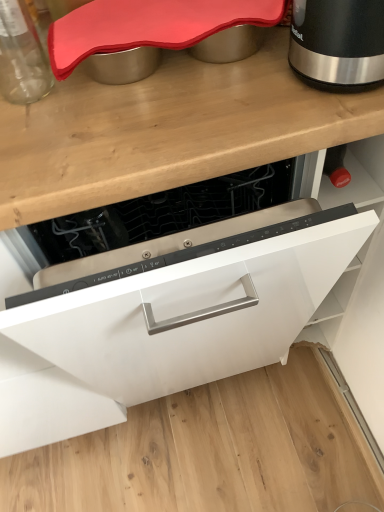
What do you see at coordinates (21, 56) in the screenshot?
I see `transparent glass jar at upper left` at bounding box center [21, 56].

What do you see at coordinates (338, 42) in the screenshot?
I see `black metallic kettle at upper right` at bounding box center [338, 42].

Find the location of `white matte cabinet at center`. white matte cabinet at center is located at coordinates (166, 323).

From a real-world perspective, between white matte cabinet at center and black metallic kettle at upper right, who is vertically lower?

From a 3D spatial view, white matte cabinet at center is below.

Does point (358, 381) come in front of point (294, 49)?

No, it is not.

Would you consider white matte cabinet at center to be distant from black metallic kettle at upper right?

Actually, white matte cabinet at center and black metallic kettle at upper right are a little close together.

Does black metallic kettle at upper right turn towards transparent glass jar at upper left?

Yes, black metallic kettle at upper right is facing transparent glass jar at upper left.

Where is `home appliance lying in front of the transparent glass jar at upper left`? The height and width of the screenshot is (512, 384). home appliance lying in front of the transparent glass jar at upper left is located at coordinates (338, 42).

From the image's perspective, between black metallic kettle at upper right and transparent glass jar at upper left, who is located below?

black metallic kettle at upper right appears lower in the image.

Is the position of black metallic kettle at upper right more distant than that of transparent glass jar at upper left?

No.

Does transparent glass jar at upper left turn towards white matte cabinet at center?

No, transparent glass jar at upper left is not turned towards white matte cabinet at center.

Between transparent glass jar at upper left and white matte cabinet at center, which one has larger size?

white matte cabinet at center.

Considering the relative sizes of transparent glass jar at upper left and white matte cabinet at center in the image provided, is transparent glass jar at upper left shorter than white matte cabinet at center?

Yes, transparent glass jar at upper left is shorter than white matte cabinet at center.

Would you say transparent glass jar at upper left is inside or outside white matte cabinet at center?

transparent glass jar at upper left is not inside white matte cabinet at center, it's outside.

Where is `home appliance located above the white matte cabinet at center (from a real-world perspective)`? Image resolution: width=384 pixels, height=512 pixels. home appliance located above the white matte cabinet at center (from a real-world perspective) is located at coordinates (338, 42).

Who is smaller, black metallic kettle at upper right or white matte cabinet at center?

With smaller size is black metallic kettle at upper right.

Based on the photo, choose the correct answer: Is black metallic kettle at upper right inside white matte cabinet at center or outside it?

black metallic kettle at upper right is not inside white matte cabinet at center, it's outside.

Which is behind, transparent glass jar at upper left or black metallic kettle at upper right?

transparent glass jar at upper left is further from the camera.

Based on their positions, is transparent glass jar at upper left located to the left or right of black metallic kettle at upper right?

In the image, transparent glass jar at upper left appears on the left side of black metallic kettle at upper right.

Is transparent glass jar at upper left outside of black metallic kettle at upper right?

transparent glass jar at upper left is positioned outside black metallic kettle at upper right.

Based on the photo, could you tell me if white matte cabinet at center is facing transparent glass jar at upper left?

No, white matte cabinet at center is not facing towards transparent glass jar at upper left.

Can you confirm if white matte cabinet at center is wider than transparent glass jar at upper left?

Indeed, white matte cabinet at center has a greater width compared to transparent glass jar at upper left.

Which point is more distant from viewer, (200, 306) or (1, 26)?

The point (1, 26) is more distant.

Locate an element on the screen. cabinetry located in front of the black metallic kettle at upper right is located at coordinates (166, 323).

The image size is (384, 512). There is a black metallic kettle at upper right. Identify the location of kitchen appliance above it (from a real-world perspective). (21, 56).

Which object lies nearer to the anchor point black metallic kettle at upper right, white matte cabinet at center or transparent glass jar at upper left?

transparent glass jar at upper left is closer to black metallic kettle at upper right.

Which object lies further to the anchor point white matte cabinet at center, black metallic kettle at upper right or transparent glass jar at upper left?

transparent glass jar at upper left lies further to white matte cabinet at center than the other object.

From the image, which object appears to be farther from white matte cabinet at center, transparent glass jar at upper left or black metallic kettle at upper right?

transparent glass jar at upper left is positioned further to the anchor white matte cabinet at center.

Which object lies further to the anchor point transparent glass jar at upper left, white matte cabinet at center or black metallic kettle at upper right?

Among the two, white matte cabinet at center is located further to transparent glass jar at upper left.

From the image, which object appears to be farther from transparent glass jar at upper left, black metallic kettle at upper right or white matte cabinet at center?

white matte cabinet at center is further to transparent glass jar at upper left.

From the picture: Based on their spatial positions, is transparent glass jar at upper left or white matte cabinet at center closer to black metallic kettle at upper right?

transparent glass jar at upper left lies closer to black metallic kettle at upper right than the other object.

Where is `cabinetry between transparent glass jar at upper left and black metallic kettle at upper right from left to right`? The image size is (384, 512). cabinetry between transparent glass jar at upper left and black metallic kettle at upper right from left to right is located at coordinates (x=166, y=323).